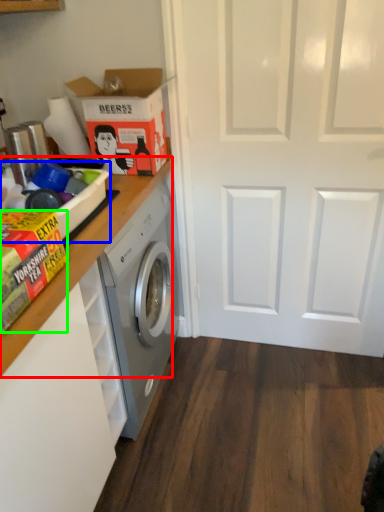
Question: Which object is positioned closest to counter top (highlighted by a red box)? Select from box (highlighted by a blue box) and cardboard box (highlighted by a green box).

Choices:
 (A) box
 (B) cardboard box

Answer: (A)